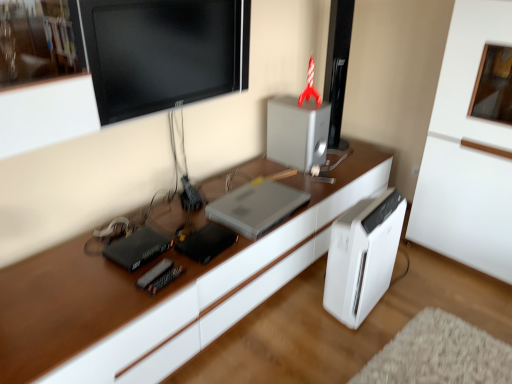
Where is `free space above white glossy desk at center (from a real-world perspective)`? Image resolution: width=512 pixels, height=384 pixels. free space above white glossy desk at center (from a real-world perspective) is located at coordinates (361, 335).